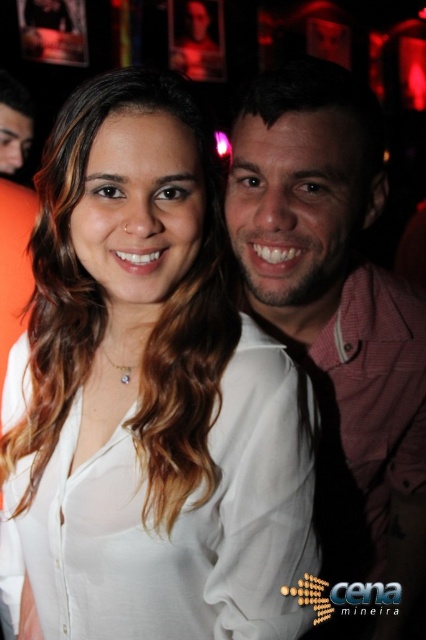
You are a photographer trying to adjust the focus of your camera. You have two points to focus on in the image, point (112, 636) and point (331, 198). Which point should you focus on first if you want to ensure the closest object is in focus?

Point (112, 636) is closer to the viewer than point (331, 198), so you should focus on point (112, 636) first to ensure the closest object is in focus.

Consider the image. You are a photographer trying to adjust the lighting for a portrait. You notice the white silky blouse at center and the matte pink shirt at center in the frame. Which clothing item is positioned higher in the image?

The white silky blouse at center is above the matte pink shirt at center, so it is positioned higher in the image.